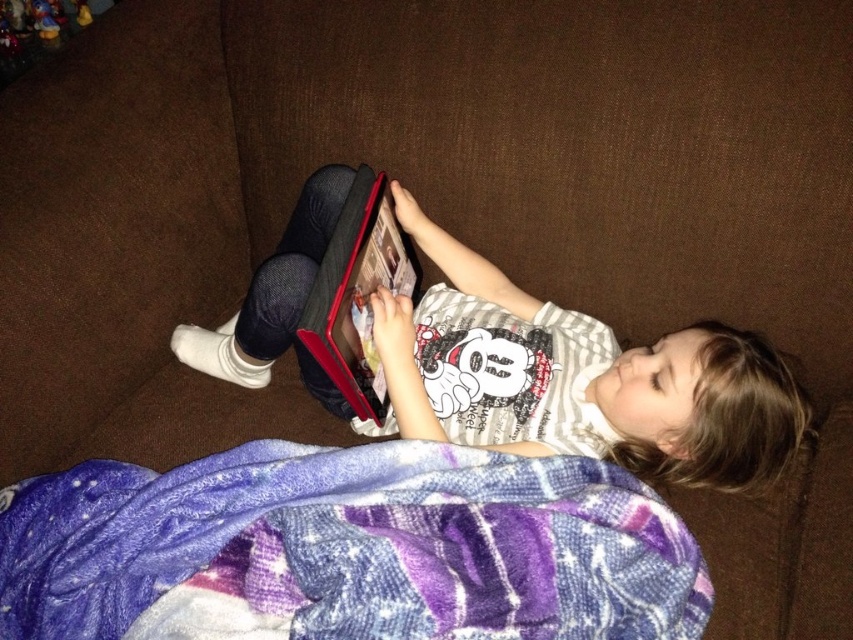
You are a parent trying to put away toys. You see the purple fleece blanket at lower center and the plush yellow duck at upper left. Which object should you place in a larger storage container?

The purple fleece blanket at lower center should be placed in a larger storage container because it is bigger than the plush yellow duck at upper left.

You are standing in the living room and want to reach the point marked at coordinates (372,458). If your arm length is 28 inches, can you reach it without moving?

The point at coordinates (372,458) is 34.40 inches away from the viewer. Since your arm length is only 28 inches, you cannot reach it without moving.